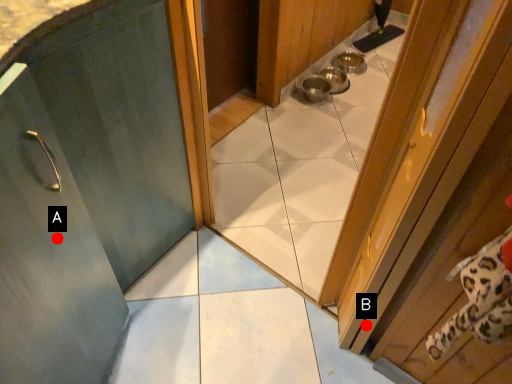
Question: Two points are circled on the image, labeled by A and B beside each circle. Which point is closer to the camera?

Choices:
 (A) A is closer
 (B) B is closer

Answer: (A)